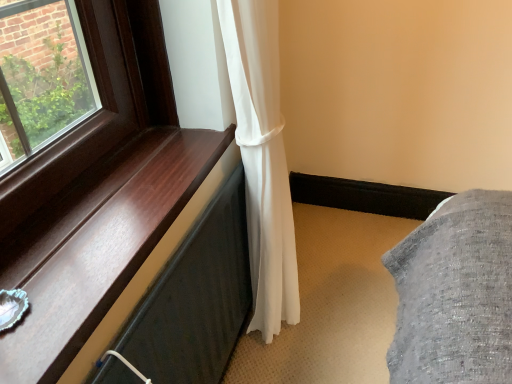
Question: Is white sheer curtain at center inside shiny wood window sill at left?

Choices:
 (A) no
 (B) yes

Answer: (A)

Question: Is shiny wood window sill at left outside white sheer curtain at center?

Choices:
 (A) yes
 (B) no

Answer: (A)

Question: From a real-world perspective, is shiny wood window sill at left located beneath white sheer curtain at center?

Choices:
 (A) no
 (B) yes

Answer: (A)

Question: Considering the relative sizes of shiny wood window sill at left and white sheer curtain at center in the image provided, is shiny wood window sill at left smaller than white sheer curtain at center?

Choices:
 (A) yes
 (B) no

Answer: (A)

Question: Is shiny wood window sill at left oriented towards white sheer curtain at center?

Choices:
 (A) yes
 (B) no

Answer: (B)

Question: Is there a large distance between shiny wood window sill at left and white sheer curtain at center?

Choices:
 (A) no
 (B) yes

Answer: (A)

Question: From a real-world perspective, is white sheer curtain at center physically below shiny wood window sill at left?

Choices:
 (A) yes
 (B) no

Answer: (A)

Question: Is white sheer curtain at center to the left of shiny wood window sill at left from the viewer's perspective?

Choices:
 (A) yes
 (B) no

Answer: (B)

Question: Does white sheer curtain at center have a lesser height compared to shiny wood window sill at left?

Choices:
 (A) yes
 (B) no

Answer: (B)

Question: Could you tell me if white sheer curtain at center is turned towards shiny wood window sill at left?

Choices:
 (A) no
 (B) yes

Answer: (A)

Question: Does white sheer curtain at center have a greater height compared to shiny wood window sill at left?

Choices:
 (A) yes
 (B) no

Answer: (A)

Question: From the image's perspective, is white sheer curtain at center over shiny wood window sill at left?

Choices:
 (A) no
 (B) yes

Answer: (B)

Question: Is shiny wood window sill at left to the left or to the right of white sheer curtain at center in the image?

Choices:
 (A) right
 (B) left

Answer: (B)